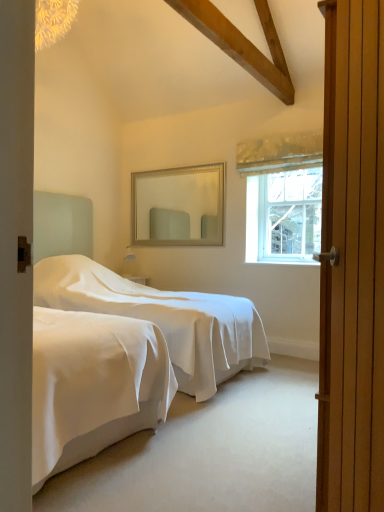
Where is `empty space that is ontop of silver/golden frame mirror at upper center (from a real-world perspective)`? Image resolution: width=384 pixels, height=512 pixels. empty space that is ontop of silver/golden frame mirror at upper center (from a real-world perspective) is located at coordinates (177, 163).